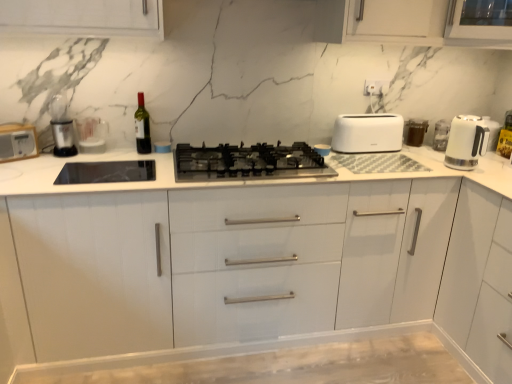
Question: Considering the positions of point (465, 271) and point (472, 125), is point (465, 271) closer or farther from the camera than point (472, 125)?

Choices:
 (A) closer
 (B) farther

Answer: (A)

Question: Considering the positions of white matte cabinet at right and white glossy electric kettle at right in the image, is white matte cabinet at right bigger or smaller than white glossy electric kettle at right?

Choices:
 (A) small
 (B) big

Answer: (B)

Question: Which of these objects is positioned closest to the white glossy electric kettle at right?

Choices:
 (A) white plastic toaster at left
 (B) brown matte container at upper right
 (C) black matte gas stove at center
 (D) white matte toaster at right
 (E) matte glass wine bottle at center

Answer: (B)

Question: Which object is positioned farthest from the white matte toaster at right?

Choices:
 (A) white glossy electric kettle at right
 (B) brown matte container at upper right
 (C) black matte gas stove at center
 (D) white plastic toaster at left
 (E) matte glass wine bottle at center

Answer: (D)